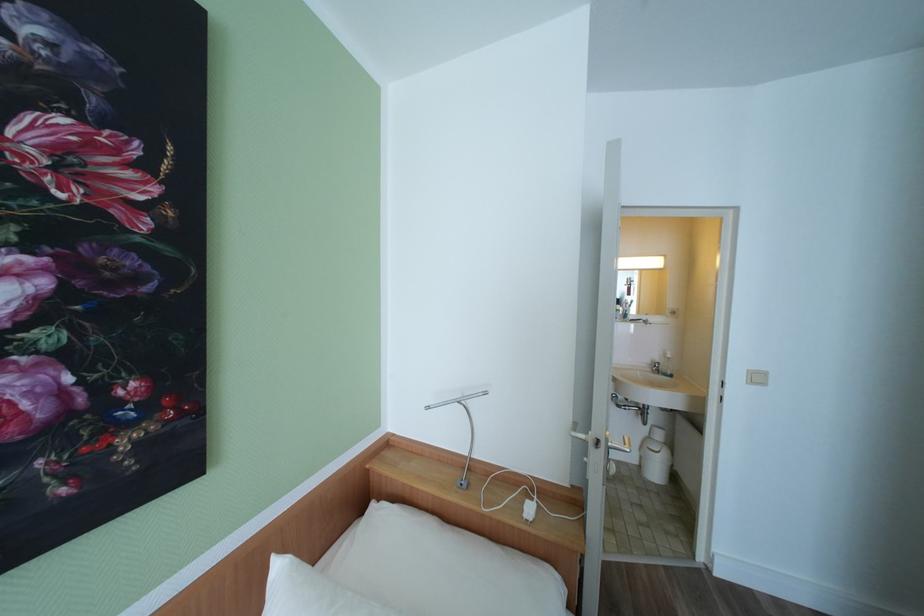
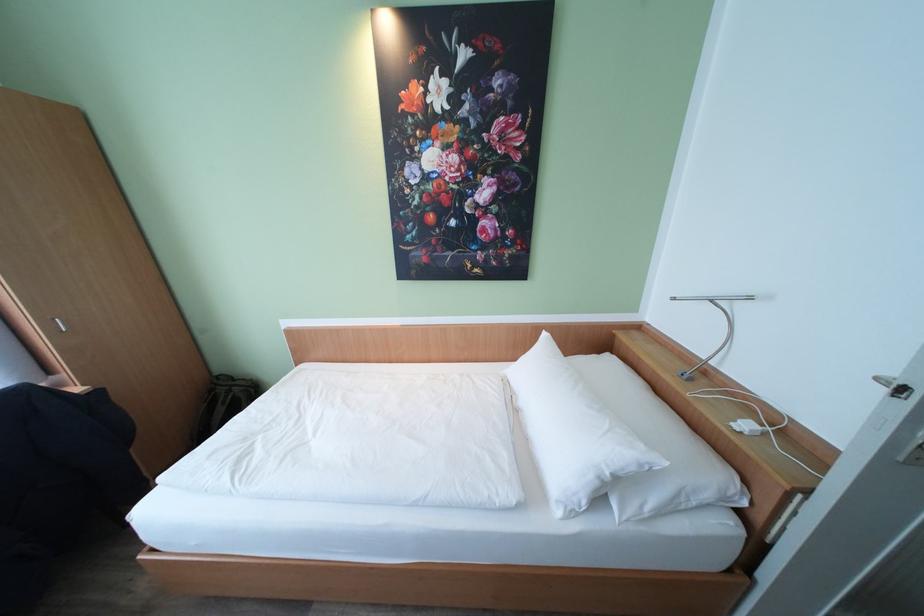
Where in the second image is the point corresponding to (x=434, y=408) from the first image?

(681, 300)